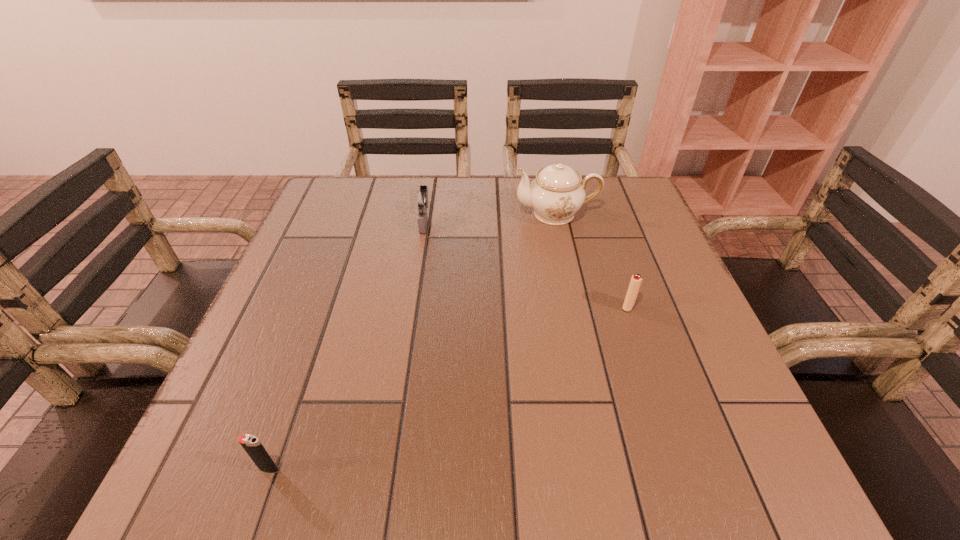
The image size is (960, 540). In order to click on object located in the far right corner section of the desktop in this screenshot , I will do `click(556, 194)`.

Identify the location of vacant space at the far edge of the desktop. The image size is (960, 540). (488, 210).

I want to click on vacant space at the near edge of the desktop, so click(x=643, y=441).

The height and width of the screenshot is (540, 960). What are the coordinates of `free space at the left edge` in the screenshot? It's located at (344, 313).

Image resolution: width=960 pixels, height=540 pixels. What are the coordinates of `free region at the right edge of the desktop` in the screenshot? It's located at (619, 269).

You are a GUI agent. You are given a task and a screenshot of the screen. Output one action in this format:
    pyautogui.click(x=<x>, y=<y>)
    Task: Click on the vacant space at the far left corner of the desktop
    This screenshot has height=540, width=960.
    Given the screenshot: What is the action you would take?
    pyautogui.click(x=371, y=183)

In the image, there is a desktop. Identify the location of vacant space at the far right corner. This screenshot has height=540, width=960. [593, 217].

Identify the location of free area in between the second nearest object and the nearest igniter. The height and width of the screenshot is (540, 960). (448, 388).

The image size is (960, 540). Identify the location of vacant space in between the nearest igniter and the tallest igniter. (347, 345).

In order to click on free space between the nearest object and the second farthest igniter in this screenshot , I will do `click(448, 388)`.